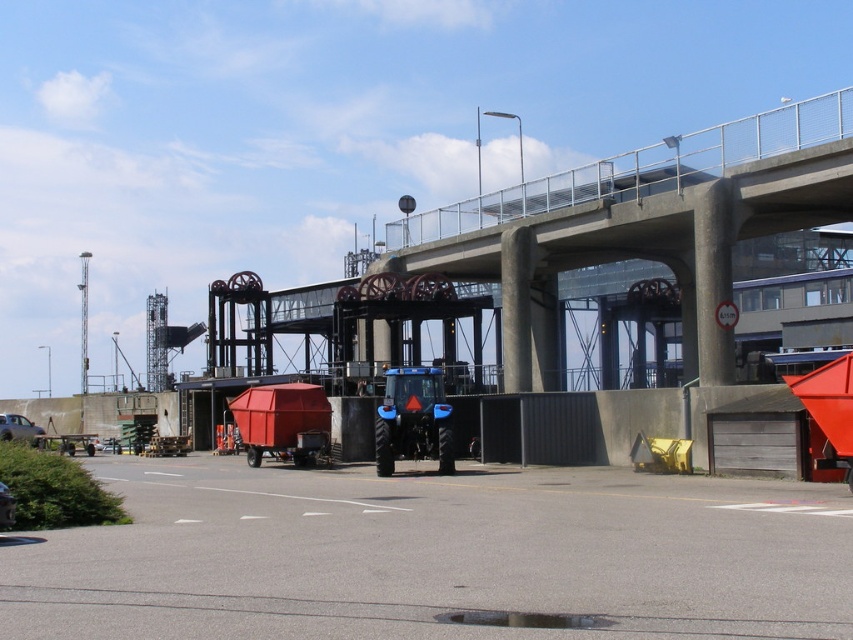
Is brushed metal car at lower left to the right of metallic silver car at lower left from the viewer's perspective?

In fact, brushed metal car at lower left is to the left of metallic silver car at lower left.

Can you confirm if brushed metal car at lower left is positioned below metallic silver car at lower left?

Correct, brushed metal car at lower left is located below metallic silver car at lower left.

At what (x,y) coordinates should I click in order to perform the action: click on brushed metal car at lower left. Please return your answer as a coordinate pair (x, y). The image size is (853, 640). Looking at the image, I should click on (19, 428).